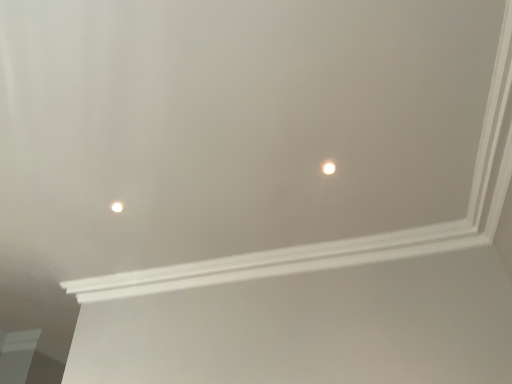
Image resolution: width=512 pixels, height=384 pixels. What do you see at coordinates (328, 167) in the screenshot?
I see `white glossy light at upper center, the first light from the right` at bounding box center [328, 167].

Find the location of a particular element. The width and height of the screenshot is (512, 384). white glossy light at upper center, which is the second light from back to front is located at coordinates (328, 167).

The image size is (512, 384). I want to click on matte white light at upper left, marked as the 2th light in a top-to-bottom arrangement, so click(x=117, y=207).

The width and height of the screenshot is (512, 384). What do you see at coordinates (117, 207) in the screenshot?
I see `matte white light at upper left, the second light viewed from the right` at bounding box center [117, 207].

In order to click on white glossy light at upper center, the first light positioned from the front in this screenshot , I will do `click(328, 167)`.

Based on their positions, is matte white light at upper left, the second light viewed from the right, located to the left or right of white glossy light at upper center, the first light from the right?

Clearly, matte white light at upper left, the second light viewed from the right, is on the left of white glossy light at upper center, the first light from the right, in the image.

Is the position of matte white light at upper left, the second light viewed from the right, less distant than that of white glossy light at upper center, acting as the second light starting from the left?

No, matte white light at upper left, the second light viewed from the right, is further to the viewer.

Which is closer, (116, 211) or (331, 174)?

Point (116, 211) appears to be farther away from the viewer than point (331, 174).

From the image's perspective, between matte white light at upper left, which is counted as the 1th light, starting from the back, and white glossy light at upper center, the first light from the right, who is located below?

matte white light at upper left, which is counted as the 1th light, starting from the back, from the image's perspective.

From a real-world perspective, which object rests below the other?

white glossy light at upper center, which is the 2th light in bottom-to-top order.

In terms of width, does matte white light at upper left, which is counted as the 1th light, starting from the back, look wider or thinner when compared to white glossy light at upper center, the 1th light viewed from the top?

matte white light at upper left, which is counted as the 1th light, starting from the back, is thinner than white glossy light at upper center, the 1th light viewed from the top.

Which of these two, matte white light at upper left, arranged as the 1th light when viewed from the left, or white glossy light at upper center, the first light positioned from the front, stands shorter?

Standing shorter between the two is white glossy light at upper center, the first light positioned from the front.

In the scene shown: Who is smaller, matte white light at upper left, which is counted as the 1th light, starting from the back, or white glossy light at upper center, the 1th light viewed from the top?

white glossy light at upper center, the 1th light viewed from the top.

Is matte white light at upper left, the second light viewed from the right, not inside white glossy light at upper center, the 1th light viewed from the top?

Yes, matte white light at upper left, the second light viewed from the right, is located beyond the bounds of white glossy light at upper center, the 1th light viewed from the top.

Is matte white light at upper left, which is counted as the 1th light, starting from the back, with white glossy light at upper center, the first light positioned from the front?

They are not placed beside each other.

From the picture: Is matte white light at upper left, marked as the 2th light in a top-to-bottom arrangement, positioned with its back to white glossy light at upper center, the 1th light viewed from the top?

No, matte white light at upper left, marked as the 2th light in a top-to-bottom arrangement, is not facing the opposite direction of white glossy light at upper center, the 1th light viewed from the top.

How many degrees apart are the facing directions of matte white light at upper left, which is counted as the 1th light, starting from the back, and white glossy light at upper center, acting as the second light starting from the left?

The angle between the facing direction of matte white light at upper left, which is counted as the 1th light, starting from the back, and the facing direction of white glossy light at upper center, acting as the second light starting from the left, is 0.00117 degrees.

The image size is (512, 384). Identify the location of light in front of the matte white light at upper left, the second light viewed from the right. (328, 167).

Considering the positions of objects white glossy light at upper center, which is the second light from back to front, and matte white light at upper left, which is the 2th light in front-to-back order, in the image provided, who is more to the right, white glossy light at upper center, which is the second light from back to front, or matte white light at upper left, which is the 2th light in front-to-back order,?

white glossy light at upper center, which is the second light from back to front.

Which object is closer to the camera, white glossy light at upper center, the first light from the right, or matte white light at upper left, which is the 2th light in front-to-back order?

white glossy light at upper center, the first light from the right, is closer to the camera.

Between point (333, 165) and point (121, 202), which one is positioned behind?

Point (121, 202)

In the scene shown: From the image's perspective, is white glossy light at upper center, the 1th light viewed from the top, beneath matte white light at upper left, arranged as the 1th light when viewed from the left?

No, from the image's perspective, white glossy light at upper center, the 1th light viewed from the top, is not below matte white light at upper left, arranged as the 1th light when viewed from the left.

From a real-world perspective, who is located higher, white glossy light at upper center, acting as the second light starting from the left, or matte white light at upper left, arranged as the 1th light when viewed from the left?

matte white light at upper left, arranged as the 1th light when viewed from the left.

Considering the relative sizes of white glossy light at upper center, the first light positioned from the front, and matte white light at upper left, the second light viewed from the right, in the image provided, is white glossy light at upper center, the first light positioned from the front, wider than matte white light at upper left, the second light viewed from the right,?

Indeed, white glossy light at upper center, the first light positioned from the front, has a greater width compared to matte white light at upper left, the second light viewed from the right.

Considering the relative sizes of white glossy light at upper center, the 1th light viewed from the top, and matte white light at upper left, the second light viewed from the right, in the image provided, is white glossy light at upper center, the 1th light viewed from the top, taller than matte white light at upper left, the second light viewed from the right,?

No, white glossy light at upper center, the 1th light viewed from the top, is not taller than matte white light at upper left, the second light viewed from the right.

Considering the sizes of objects white glossy light at upper center, the 1th light viewed from the top, and matte white light at upper left, arranged as the 1th light when viewed from the left, in the image provided, who is smaller, white glossy light at upper center, the 1th light viewed from the top, or matte white light at upper left, arranged as the 1th light when viewed from the left,?

Smaller between the two is white glossy light at upper center, the 1th light viewed from the top.

Can matte white light at upper left, arranged as the 1th light when viewed from the left, be found inside white glossy light at upper center, acting as the second light starting from the left?

No, matte white light at upper left, arranged as the 1th light when viewed from the left, is not surrounded by white glossy light at upper center, acting as the second light starting from the left.

Are white glossy light at upper center, which is the second light from back to front, and matte white light at upper left, marked as the 1th light in a bottom-to-top arrangement, making contact?

There is a gap between white glossy light at upper center, which is the second light from back to front, and matte white light at upper left, marked as the 1th light in a bottom-to-top arrangement.

Is white glossy light at upper center, which is the 2th light in bottom-to-top order, turned away from matte white light at upper left, which is counted as the 1th light, starting from the back?

No, white glossy light at upper center, which is the 2th light in bottom-to-top order,'s orientation is not away from matte white light at upper left, which is counted as the 1th light, starting from the back.

You are a GUI agent. You are given a task and a screenshot of the screen. Output one action in this format:
    pyautogui.click(x=<x>, y=<y>)
    Task: Click on the light in front of the matte white light at upper left, arranged as the 1th light when viewed from the left
    The width and height of the screenshot is (512, 384).
    Given the screenshot: What is the action you would take?
    pyautogui.click(x=328, y=167)

Find the location of a particular element. light that is under the matte white light at upper left, which is counted as the 1th light, starting from the back (from a real-world perspective) is located at coordinates (328, 167).

The image size is (512, 384). In order to click on light positioned vertically above the white glossy light at upper center, the first light from the right (from a real-world perspective) in this screenshot , I will do `click(117, 207)`.